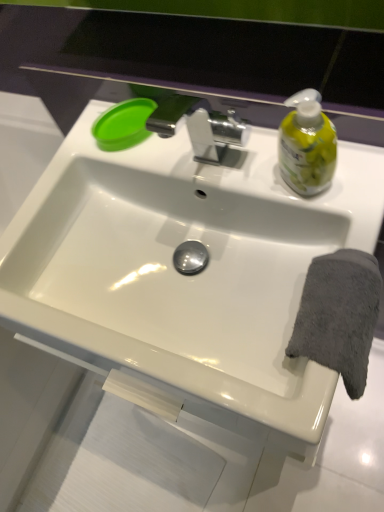
Question: Can you confirm if white glossy sink at center is smaller than gray soft towel at right?

Choices:
 (A) no
 (B) yes

Answer: (A)

Question: Is white glossy sink at center far away from gray soft towel at right?

Choices:
 (A) no
 (B) yes

Answer: (A)

Question: Can you confirm if white glossy sink at center is bigger than gray soft towel at right?

Choices:
 (A) yes
 (B) no

Answer: (A)

Question: Is white glossy sink at center to the right of gray soft towel at right from the viewer's perspective?

Choices:
 (A) yes
 (B) no

Answer: (B)

Question: Is white glossy sink at center oriented away from gray soft towel at right?

Choices:
 (A) no
 (B) yes

Answer: (A)

Question: Based on their positions, is green plastic lid at upper left located to the left or right of gray soft towel at right?

Choices:
 (A) right
 (B) left

Answer: (B)

Question: Based on their sizes in the image, would you say green plastic lid at upper left is bigger or smaller than gray soft towel at right?

Choices:
 (A) big
 (B) small

Answer: (B)

Question: Looking at their shapes, would you say green plastic lid at upper left is wider or thinner than gray soft towel at right?

Choices:
 (A) thin
 (B) wide

Answer: (A)

Question: Is point click(140, 118) closer or farther from the camera than point click(360, 306)?

Choices:
 (A) farther
 (B) closer

Answer: (A)

Question: Considering the positions of gray soft towel at right and green plastic lid at upper left in the image, is gray soft towel at right taller or shorter than green plastic lid at upper left?

Choices:
 (A) tall
 (B) short

Answer: (A)

Question: From a real-world perspective, is gray soft towel at right above or below green plastic lid at upper left?

Choices:
 (A) below
 (B) above

Answer: (A)

Question: From the image's perspective, relative to green plastic lid at upper left, is gray soft towel at right above or below?

Choices:
 (A) below
 (B) above

Answer: (A)

Question: Looking at the image, does gray soft towel at right seem bigger or smaller compared to green plastic lid at upper left?

Choices:
 (A) big
 (B) small

Answer: (A)

Question: From their relative heights in the image, would you say white glossy sink at center is taller or shorter than gray soft towel at right?

Choices:
 (A) tall
 (B) short

Answer: (B)

Question: Is white glossy sink at center inside or outside of gray soft towel at right?

Choices:
 (A) outside
 (B) inside

Answer: (A)